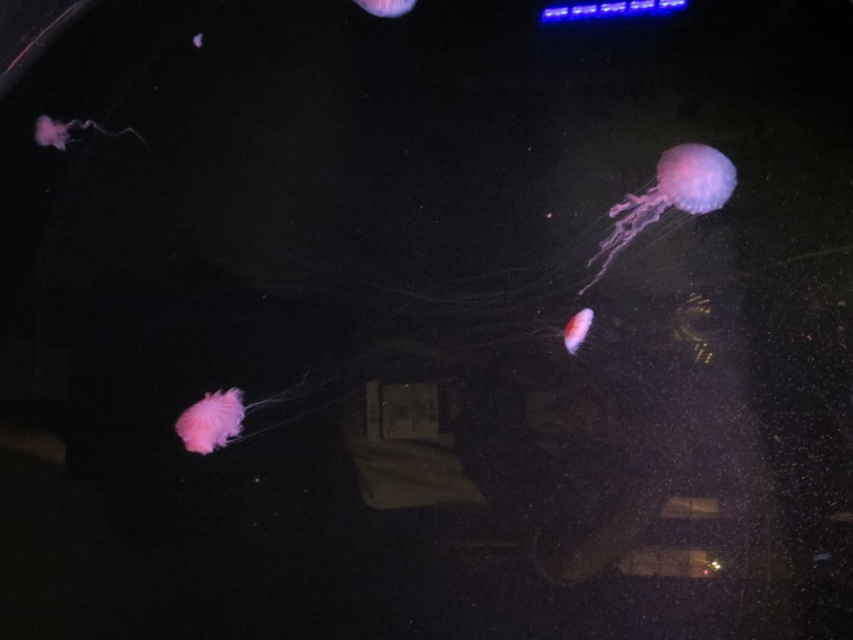
Question: Among these points, which one is farthest from the camera?

Choices:
 (A) (370, 0)
 (B) (662, 157)

Answer: (A)

Question: Based on their relative distances, which object is farther from the translucent purple jellyfish at upper right?

Choices:
 (A) translucent pink jellyfish at center
 (B) translucent pink jellyfish at upper center
 (C) translucent pink jellyfish at lower left

Answer: (C)

Question: Considering the real-world distances, which object is closest to the translucent pink jellyfish at lower left?

Choices:
 (A) translucent pink jellyfish at upper left
 (B) translucent pink jellyfish at upper center
 (C) translucent pink jellyfish at center
 (D) translucent purple jellyfish at upper right

Answer: (A)

Question: Can you confirm if translucent pink jellyfish at lower left is smaller than translucent pink jellyfish at upper left?

Choices:
 (A) yes
 (B) no

Answer: (B)

Question: Does translucent purple jellyfish at upper right have a larger size compared to translucent pink jellyfish at lower left?

Choices:
 (A) no
 (B) yes

Answer: (B)

Question: Is the position of translucent pink jellyfish at upper left less distant than that of translucent pink jellyfish at upper center?

Choices:
 (A) no
 (B) yes

Answer: (B)